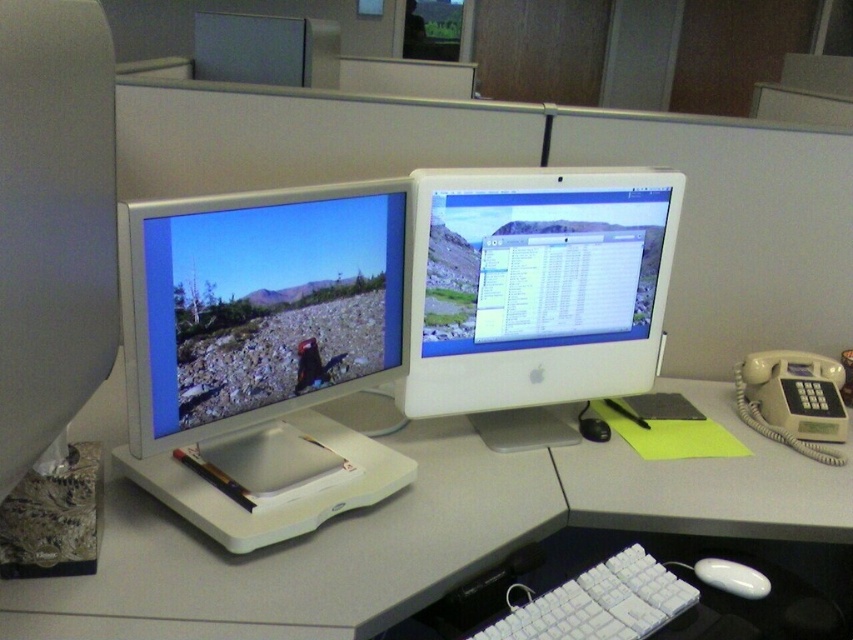
You are sitting at the desk facing the two monitors. There are two points marked on the desk. One is at coordinates point (322, 202) and the other is at point (540, 611). If you were to draw a straight line from your current position to each point, which point would require you to look further back in the workspace?

Point (322, 202) is behind point (540, 611), so you would need to look further back to reach it.

You are organizing your desk and need to place a new item between the white plastic monitor at center and the black plastic mouse at center. Based on their positions, where should you place the item?

The white plastic monitor at center is to the left of the black plastic mouse at center, so you should place the new item between them by positioning it to the right of the white plastic monitor at center and to the left of the black plastic mouse at center.